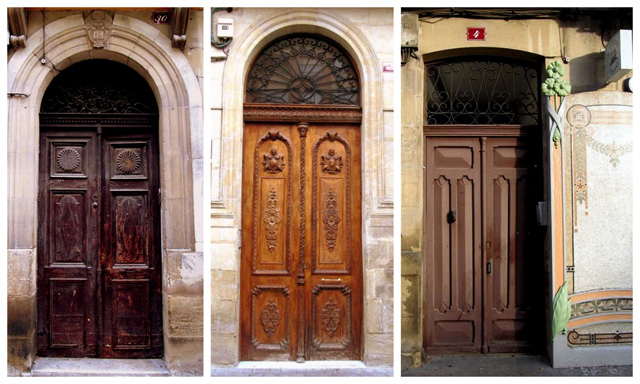
This screenshot has height=384, width=640. Find the location of `brown door panels`. brown door panels is located at coordinates (502, 251), (450, 250), (331, 238), (265, 239), (66, 253), (129, 248).